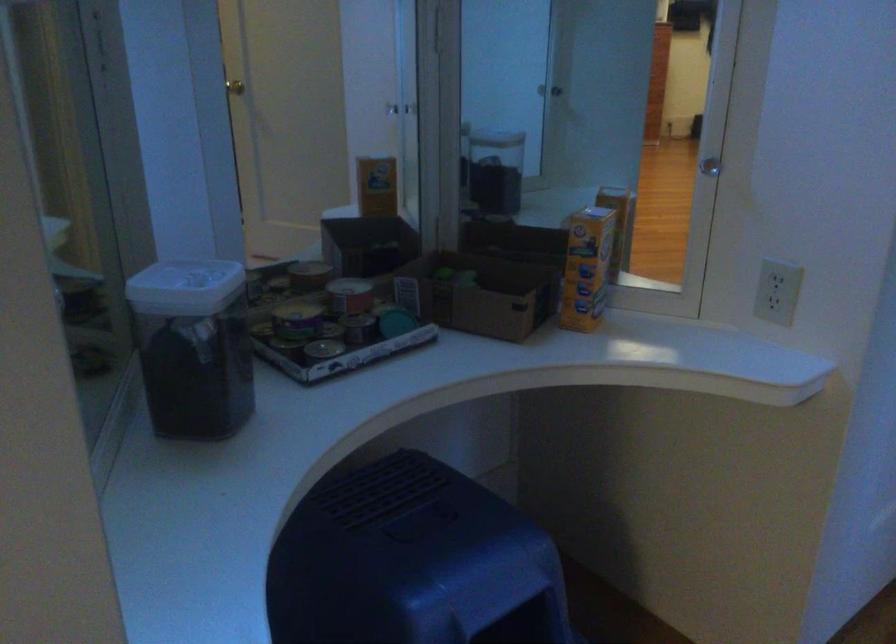
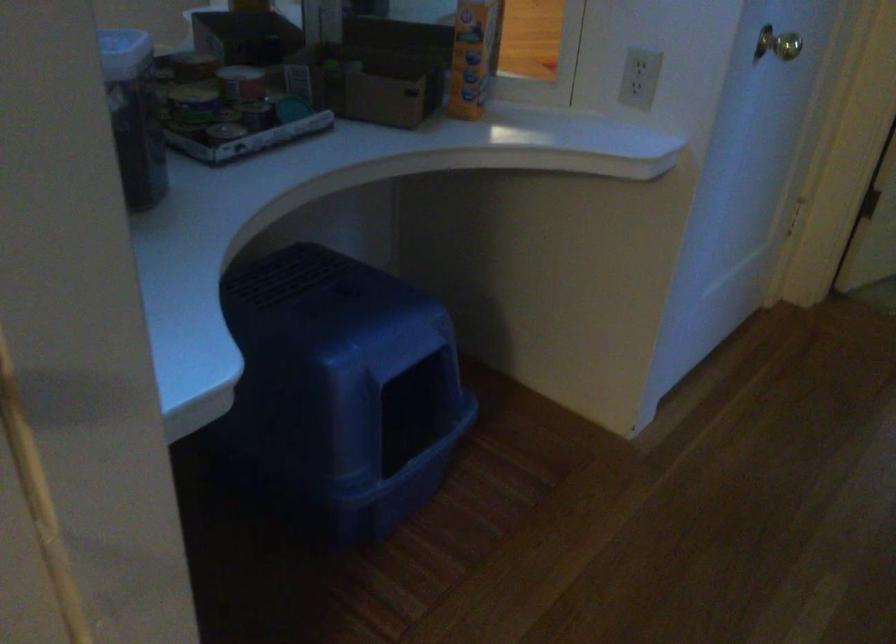
Find the pixel in the second image that matches [209,289] in the first image.

(124, 53)